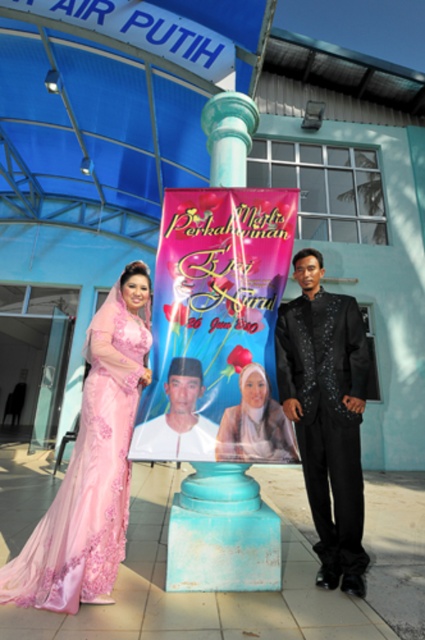
You are a photographer at a wedding venue. You need to position two guests for a photo. The guests are wearing the pink satin dress at left and the matte white shirt at center. The minimum distance required for proper framing is 40 centimeters. Can they stand closer than the required distance?

The pink satin dress at left and the matte white shirt at center are 37.21 centimeters apart, which is less than the required 40 centimeters. Therefore, they can stand closer than the required distance.

You are a photographer at a wedding event. You need to capture a photo of the pink satin banner at center and the matte white shirt at center. According to the scene description, which object is located to the right of the other?

The pink satin banner at center is positioned on the right side of matte white shirt at center.

You are a photographer setting up for a wedding photo shoot. You need to position a backdrop that is 1.5 meters wide. The backdrop must be placed between the pink satin dress at left and the matte white shirt at center. Will the backdrop fit between them based on their widths?

The pink satin dress at left is wider than the matte white shirt at center. However, the total width between them isn